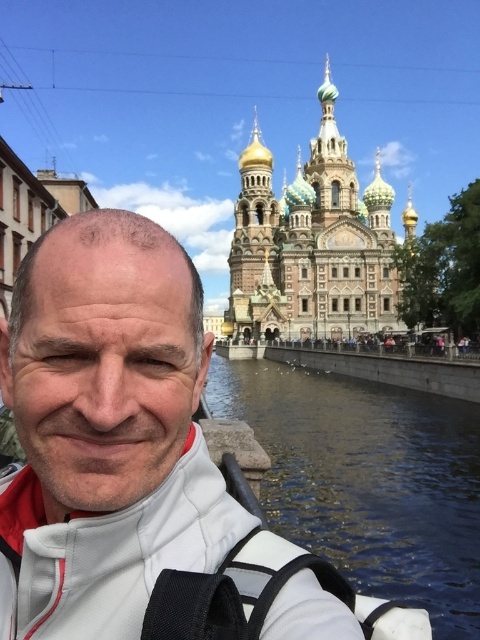
Does white quilted jacket at lower center appear over dark blue water at center?

Yes.

Can you confirm if white quilted jacket at lower center is positioned to the right of dark blue water at center?

No, white quilted jacket at lower center is not to the right of dark blue water at center.

What are the coordinates of `white quilted jacket at lower center` in the screenshot? It's located at click(x=136, y=461).

The image size is (480, 640). Identify the location of white quilted jacket at lower center. (136, 461).

Between point (367, 474) and point (343, 257), which one is positioned behind?

Positioned behind is point (343, 257).

Does dark blue water at center appear under golden domed cathedral at upper center?

Correct, dark blue water at center is located below golden domed cathedral at upper center.

Is point (264, 374) closer to camera compared to point (365, 259)?

Yes.

Find the location of a particular element. This screenshot has width=480, height=640. dark blue water at center is located at coordinates (369, 481).

Is white quilted jacket at lower center positioned before golden domed cathedral at upper center?

Yes, it is.

Who is shorter, white quilted jacket at lower center or golden domed cathedral at upper center?

white quilted jacket at lower center

Does point (76, 292) come behind point (235, 253)?

No.

I want to click on white quilted jacket at lower center, so [136, 461].